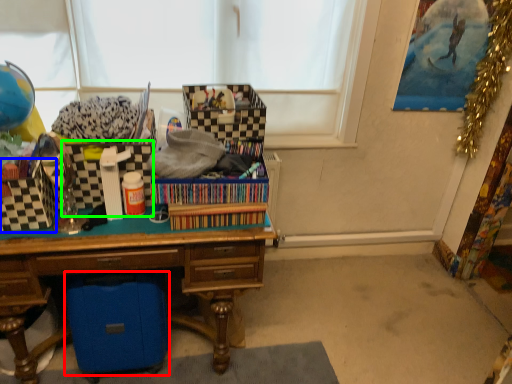
Question: Which object is positioned farthest from storage box (highlighted by a red box)? Select from storage box (highlighted by a blue box) and storage box (highlighted by a green box).

Choices:
 (A) storage box
 (B) storage box

Answer: (B)